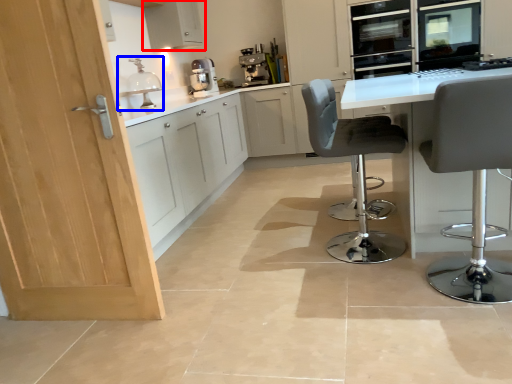
Question: Which point is closer to the camera, cabinetry (highlighted by a red box) or sink (highlighted by a blue box)?

Choices:
 (A) cabinetry
 (B) sink

Answer: (B)